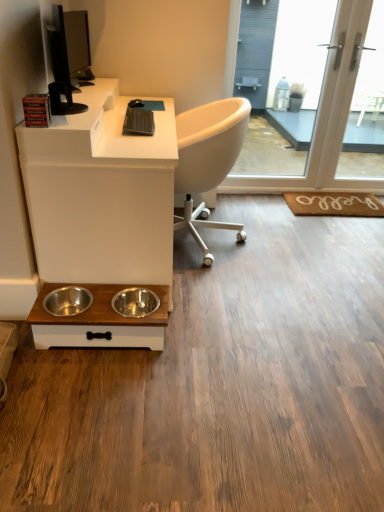
Question: From the image's perspective, is brown woven mat at lower right located beneath stainless steel bowls at lower center?

Choices:
 (A) no
 (B) yes

Answer: (A)

Question: From a real-world perspective, does brown woven mat at lower right stand above stainless steel bowls at lower center?

Choices:
 (A) yes
 (B) no

Answer: (B)

Question: From a real-world perspective, is brown woven mat at lower right positioned under stainless steel bowls at lower center based on gravity?

Choices:
 (A) no
 (B) yes

Answer: (B)

Question: Is brown woven mat at lower right to the left of stainless steel bowls at lower center from the viewer's perspective?

Choices:
 (A) no
 (B) yes

Answer: (A)

Question: Is stainless steel bowls at lower center at the back of brown woven mat at lower right?

Choices:
 (A) yes
 (B) no

Answer: (B)

Question: Is brown woven mat at lower right outside of stainless steel bowls at lower center?

Choices:
 (A) no
 (B) yes

Answer: (B)

Question: Is white glass screen door at upper right, which ranks as the second screen door in left-to-right order, positioned with its back to stainless steel bowls at lower center?

Choices:
 (A) no
 (B) yes

Answer: (A)

Question: Can you confirm if white glass screen door at upper right, which ranks as the second screen door in left-to-right order, is thinner than stainless steel bowls at lower center?

Choices:
 (A) no
 (B) yes

Answer: (B)

Question: Would you consider white glass screen door at upper right, which ranks as the second screen door in left-to-right order, to be distant from stainless steel bowls at lower center?

Choices:
 (A) yes
 (B) no

Answer: (A)

Question: From the image's perspective, does white glass screen door at upper right, the first screen door from the right, appear lower than stainless steel bowls at lower center?

Choices:
 (A) no
 (B) yes

Answer: (A)

Question: Does white glass screen door at upper right, which ranks as the second screen door in left-to-right order, turn towards stainless steel bowls at lower center?

Choices:
 (A) no
 (B) yes

Answer: (A)

Question: From the image's perspective, does white glass screen door at upper right, which ranks as the second screen door in left-to-right order, appear higher than stainless steel bowls at lower center?

Choices:
 (A) yes
 (B) no

Answer: (A)

Question: Considering the relative positions of white matte desk at lower left and black glossy monitor at upper left in the image provided, is white matte desk at lower left in front of black glossy monitor at upper left?

Choices:
 (A) yes
 (B) no

Answer: (A)